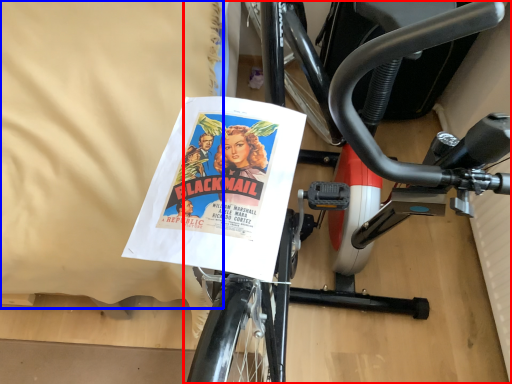
Question: Which object is further to the camera taking this photo, bicycle (highlighted by a red box) or sheet (highlighted by a blue box)?

Choices:
 (A) bicycle
 (B) sheet

Answer: (B)